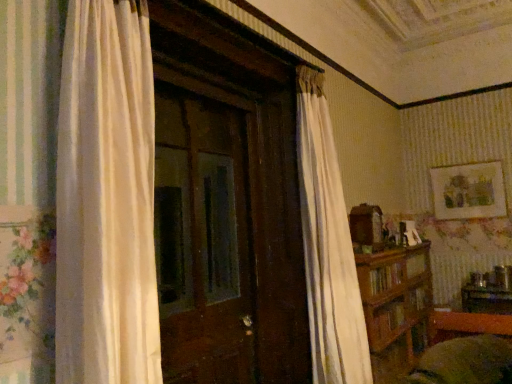
Question: Considering the relative sizes of matte gold picture frame at upper right and wooden table at lower right in the image provided, is matte gold picture frame at upper right smaller than wooden table at lower right?

Choices:
 (A) no
 (B) yes

Answer: (B)

Question: Does matte gold picture frame at upper right have a greater width compared to wooden table at lower right?

Choices:
 (A) no
 (B) yes

Answer: (A)

Question: Is matte gold picture frame at upper right outside of wooden table at lower right?

Choices:
 (A) yes
 (B) no

Answer: (A)

Question: Is matte gold picture frame at upper right oriented towards wooden table at lower right?

Choices:
 (A) no
 (B) yes

Answer: (A)

Question: Is wooden table at lower right inside matte gold picture frame at upper right?

Choices:
 (A) yes
 (B) no

Answer: (B)

Question: Does point (452, 210) appear closer or farther from the camera than point (423, 324)?

Choices:
 (A) farther
 (B) closer

Answer: (A)

Question: Considering their positions, is matte gold picture frame at upper right located in front of or behind brown wooden bookshelf at right?

Choices:
 (A) front
 (B) behind

Answer: (B)

Question: Is matte gold picture frame at upper right wider or thinner than brown wooden bookshelf at right?

Choices:
 (A) wide
 (B) thin

Answer: (B)

Question: Choose the correct answer: Is matte gold picture frame at upper right inside brown wooden bookshelf at right or outside it?

Choices:
 (A) inside
 (B) outside

Answer: (B)

Question: Is brown wooden bookshelf at right in front of or behind matte gold picture frame at upper right in the image?

Choices:
 (A) front
 (B) behind

Answer: (A)

Question: Is brown wooden bookshelf at right spatially inside matte gold picture frame at upper right, or outside of it?

Choices:
 (A) inside
 (B) outside

Answer: (B)

Question: Considering the relative positions of brown wooden bookshelf at right and matte gold picture frame at upper right in the image provided, is brown wooden bookshelf at right to the left or to the right of matte gold picture frame at upper right?

Choices:
 (A) left
 (B) right

Answer: (A)

Question: Is point (387, 278) closer or farther from the camera than point (470, 201)?

Choices:
 (A) closer
 (B) farther

Answer: (A)

Question: From a real-world perspective, is brown wooden bookshelf at right above or below wooden table at lower right?

Choices:
 (A) below
 (B) above

Answer: (B)

Question: In terms of size, does brown wooden bookshelf at right appear bigger or smaller than wooden table at lower right?

Choices:
 (A) small
 (B) big

Answer: (B)